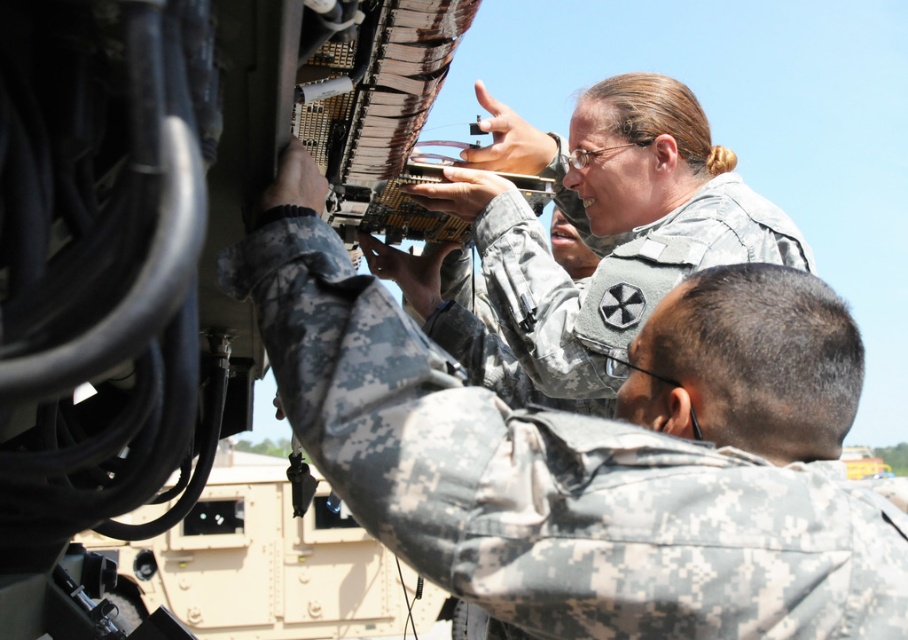
You are a military observer trying to identify the position of two soldiers in the image. Which soldier, the camouflage uniform at center or the camouflage fabric uniform at upper center, is closer to you?

The camouflage uniform at center is closer to you because it is in front of the camouflage fabric uniform at upper center.

You are a military technician positioned at the origin point of the coordinate system. You need to locate the camouflage uniform at center. What are the coordinates where you should move to find it?

The camouflage uniform at center is located at coordinates point (577, 460).

You are a military engineer who needs to reach the camouflage fabric uniform at upper center from the camouflage uniform at center. Given that your equipment is 3 feet wide, will you be able to move through the space between them?

The distance between the camouflage uniform at center and the camouflage fabric uniform at upper center is 8.51 feet. Since your equipment is only 3 feet wide, you have sufficient space to move through the area between them.